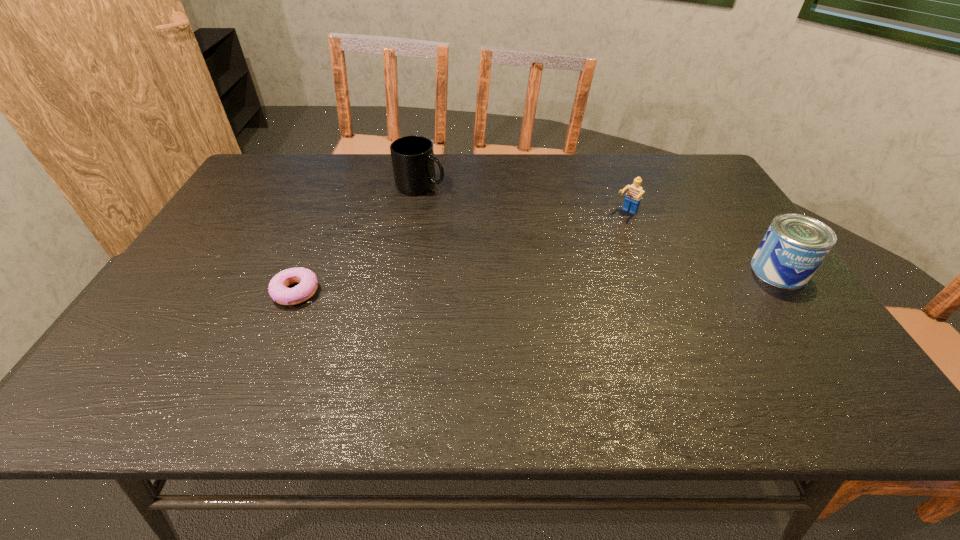
Find the location of `free space on the desktop that is between the doughnut and the rightmost object and is positioned on the face of the Lego`. free space on the desktop that is between the doughnut and the rightmost object and is positioned on the face of the Lego is located at coordinates coord(555,281).

This screenshot has width=960, height=540. I want to click on vacant space on the desktop that is between the shortest object and the can and is positioned with the handle on the side of the third object from right to left, so click(x=596, y=279).